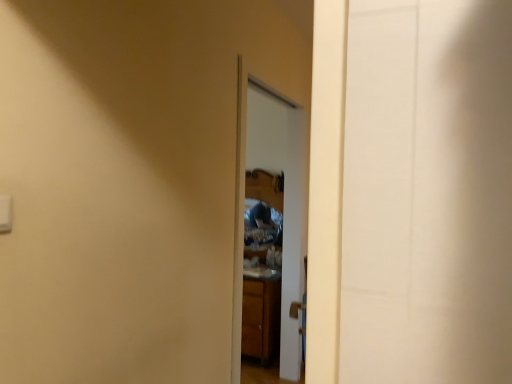
Locate an element on the screen. The height and width of the screenshot is (384, 512). white plastic light switch at upper left is located at coordinates (5, 213).

Find the location of a particular element. The width and height of the screenshot is (512, 384). wooden cabinet at center is located at coordinates coord(261,319).

At what (x,y) coordinates should I click in order to perform the action: click on glossy wooden mirror at center. Please return your answer as a coordinate pair (x, y). The image size is (512, 384). Looking at the image, I should click on (264, 197).

The height and width of the screenshot is (384, 512). What are the coordinates of `white plastic light switch at upper left` in the screenshot? It's located at (5, 213).

Which is correct: glossy wooden mirror at center is inside wooden cabinet at center, or outside of it?

glossy wooden mirror at center is outside wooden cabinet at center.

Which is farther from the camera, (262,209) or (253,345)?

Positioned behind is point (262,209).

Find the location of a particular element. This screenshot has width=512, height=384. mirror above the wooden cabinet at center (from the image's perspective) is located at coordinates (264, 197).

Is white plastic light switch at upper left at the left side of glossy wooden mirror at center?

Yes, white plastic light switch at upper left is to the left of glossy wooden mirror at center.

I want to click on mirror lying on the right of white plastic light switch at upper left, so click(264, 197).

Considering the relative positions of white plastic light switch at upper left and glossy wooden mirror at center in the image provided, is white plastic light switch at upper left in front of glossy wooden mirror at center?

Yes.

Can you tell me how much wooden cabinet at center and white plastic light switch at upper left differ in facing direction?

The angle between the facing direction of wooden cabinet at center and the facing direction of white plastic light switch at upper left is 90 degrees.

Considering the positions of objects wooden cabinet at center and white plastic light switch at upper left in the image provided, who is more to the left, wooden cabinet at center or white plastic light switch at upper left?

From the viewer's perspective, white plastic light switch at upper left appears more on the left side.

Between wooden cabinet at center and white plastic light switch at upper left, which one has larger size?

With larger size is wooden cabinet at center.

Which point is more forward, (261, 355) or (11, 227)?

The point (11, 227) is more forward.

Which of these two, glossy wooden mirror at center or white plastic light switch at upper left, stands shorter?

white plastic light switch at upper left is shorter.

From the image's perspective, is glossy wooden mirror at center above or below white plastic light switch at upper left?

From the image's perspective, glossy wooden mirror at center appears below white plastic light switch at upper left.

Based on the photo, are glossy wooden mirror at center and white plastic light switch at upper left located far from each other?

Absolutely, glossy wooden mirror at center is distant from white plastic light switch at upper left.

Is glossy wooden mirror at center thinner than white plastic light switch at upper left?

No.

Considering the sizes of wooden cabinet at center and glossy wooden mirror at center in the image, is wooden cabinet at center bigger or smaller than glossy wooden mirror at center?

Clearly, wooden cabinet at center is smaller in size than glossy wooden mirror at center.

Measure the distance from wooden cabinet at center to glossy wooden mirror at center.

wooden cabinet at center is 32.04 inches from glossy wooden mirror at center.

Can you confirm if wooden cabinet at center is shorter than glossy wooden mirror at center?

Incorrect, the height of wooden cabinet at center does not fall short of that of glossy wooden mirror at center.

Considering the sizes of wooden cabinet at center and glossy wooden mirror at center in the image, is wooden cabinet at center wider or thinner than glossy wooden mirror at center?

wooden cabinet at center is thinner than glossy wooden mirror at center.

Which object is wider, white plastic light switch at upper left or wooden cabinet at center?

wooden cabinet at center.

Does white plastic light switch at upper left come in front of wooden cabinet at center?

Yes.

In terms of size, does white plastic light switch at upper left appear bigger or smaller than wooden cabinet at center?

white plastic light switch at upper left is smaller than wooden cabinet at center.

Are white plastic light switch at upper left and wooden cabinet at center beside each other?

white plastic light switch at upper left is not next to wooden cabinet at center, and they're not touching.

Locate an element on the screen. The height and width of the screenshot is (384, 512). mirror that appears on the right of wooden cabinet at center is located at coordinates (264, 197).

Image resolution: width=512 pixels, height=384 pixels. I want to click on mirror that appears behind the white plastic light switch at upper left, so click(x=264, y=197).

Estimate the real-world distances between objects in this image. Which object is further from white plastic light switch at upper left, wooden cabinet at center or glossy wooden mirror at center?

glossy wooden mirror at center lies further to white plastic light switch at upper left than the other object.

Which object lies nearer to the anchor point glossy wooden mirror at center, wooden cabinet at center or white plastic light switch at upper left?

Among the two, wooden cabinet at center is located nearer to glossy wooden mirror at center.

Based on the photo, which object lies nearer to the anchor point glossy wooden mirror at center, white plastic light switch at upper left or wooden cabinet at center?

wooden cabinet at center.

Looking at the image, which one is located closer to white plastic light switch at upper left, glossy wooden mirror at center or wooden cabinet at center?

Based on the image, wooden cabinet at center appears to be nearer to white plastic light switch at upper left.

Based on their spatial positions, is glossy wooden mirror at center or white plastic light switch at upper left closer to wooden cabinet at center?

The object closer to wooden cabinet at center is glossy wooden mirror at center.

From the image, which object appears to be nearer to wooden cabinet at center, white plastic light switch at upper left or glossy wooden mirror at center?

The object closer to wooden cabinet at center is glossy wooden mirror at center.

The image size is (512, 384). In order to click on mirror between white plastic light switch at upper left and wooden cabinet at center along the z-axis in this screenshot , I will do point(264,197).